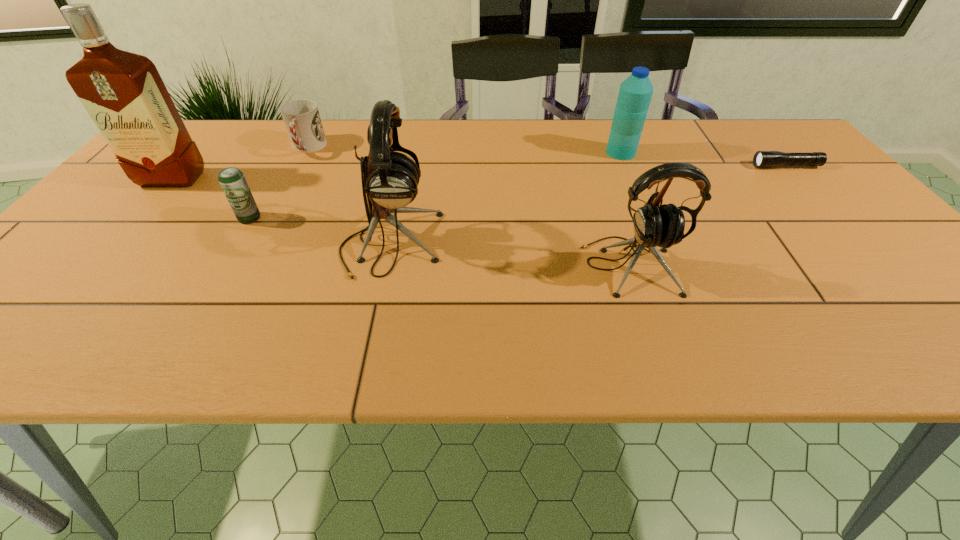
In order to click on free area in between the shorter earphone and the water bottle in this screenshot , I will do `click(625, 209)`.

This screenshot has height=540, width=960. I want to click on free space between the left earphone and the rightmost object, so click(588, 205).

Locate an element on the screen. The image size is (960, 540). free point between the cup and the fourth object from left to right is located at coordinates (349, 196).

Identify the location of free space between the second tallest object and the liquor. (282, 211).

The image size is (960, 540). Identify the location of free space that is in between the right earphone and the sixth shortest object. 510,255.

Locate an element on the screen. The height and width of the screenshot is (540, 960). free area in between the taller earphone and the shorter earphone is located at coordinates (510, 255).

Identify which object is the second nearest to the liquor. Please provide its 2D coordinates. Your answer should be formatted as a tuple, i.e. [(x, y)], where the tuple contains the x and y coordinates of a point satisfying the conditions above.

[(301, 117)]

Identify which object is the fifth nearest to the liquor. Please provide its 2D coordinates. Your answer should be formatted as a tuple, i.e. [(x, y)], where the tuple contains the x and y coordinates of a point satisfying the conditions above.

[(635, 93)]

You are a GUI agent. You are given a task and a screenshot of the screen. Output one action in this format:
    pyautogui.click(x=<x>, y=<y>)
    Task: Click on the vacant position in the image that satisfies the following two spatial constraints: 1. on the side of the taller earphone where the handle is located; 2. on the left side of the cup
    The width and height of the screenshot is (960, 540).
    Given the screenshot: What is the action you would take?
    pyautogui.click(x=257, y=244)

You are a GUI agent. You are given a task and a screenshot of the screen. Output one action in this format:
    pyautogui.click(x=<x>, y=<y>)
    Task: Click on the free space that satisfies the following two spatial constraints: 1. on the side of the second tallest object where the handle is located; 2. on the right side of the cup
    The height and width of the screenshot is (540, 960).
    Given the screenshot: What is the action you would take?
    pyautogui.click(x=257, y=244)